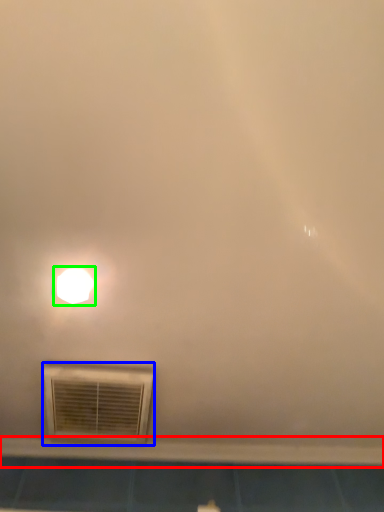
Question: Based on their relative distances, which object is farther from window sill (highlighted by a red box)? Choose from air conditioning (highlighted by a blue box) and lamp (highlighted by a green box).

Choices:
 (A) air conditioning
 (B) lamp

Answer: (B)